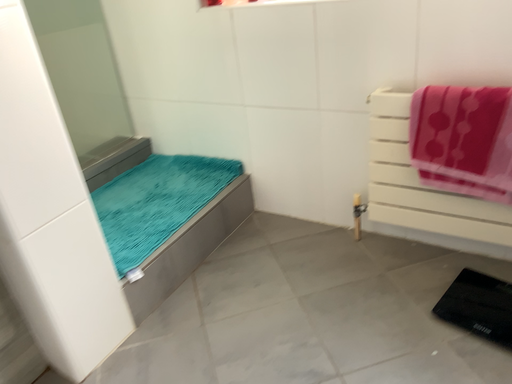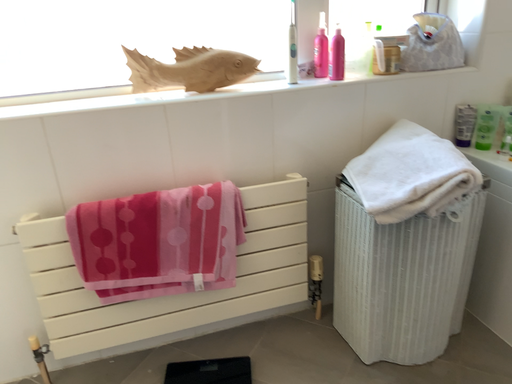
Question: Which way did the camera rotate in the video?

Choices:
 (A) rotated right
 (B) rotated left

Answer: (A)